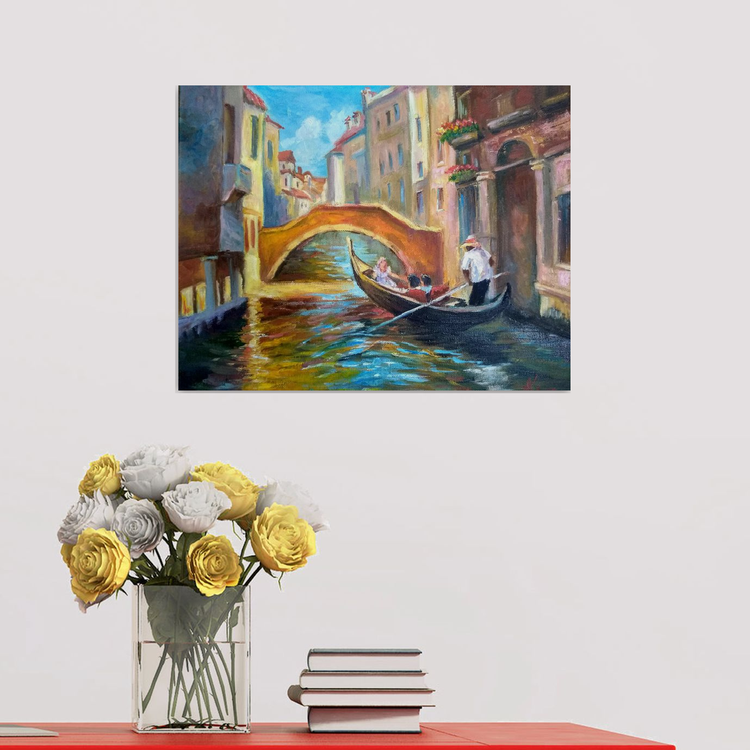
Identify the location of vase. The width and height of the screenshot is (750, 750). (145, 637).